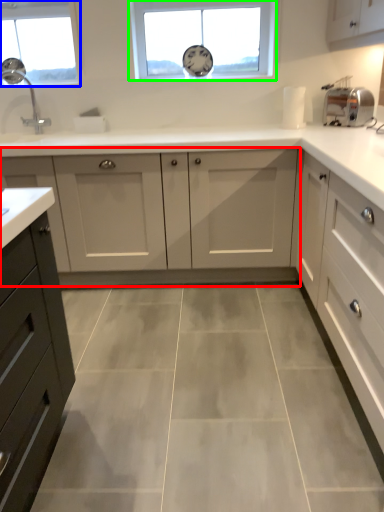
Question: Estimate the real-world distances between objects in this image. Which object is closer to cabinetry (highlighted by a red box), window (highlighted by a blue box) or window (highlighted by a green box)?

Choices:
 (A) window
 (B) window

Answer: (B)